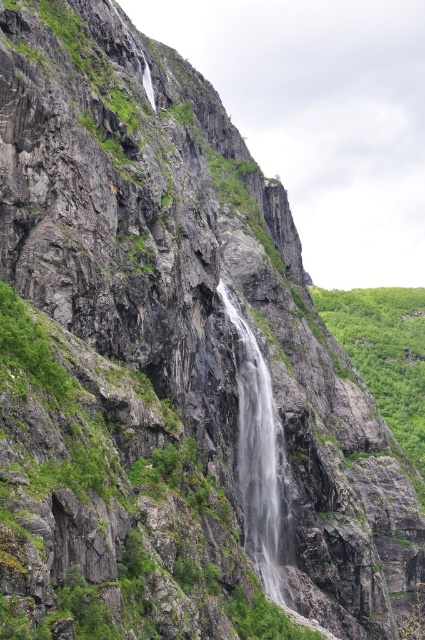
Question: Does green mossy rock at center have a larger size compared to clear gray water at center?

Choices:
 (A) no
 (B) yes

Answer: (B)

Question: Which of the following is the farthest from the observer?

Choices:
 (A) green mossy rock at center
 (B) clear gray water at center

Answer: (B)

Question: Can you confirm if green mossy rock at center is positioned to the right of clear gray water at center?

Choices:
 (A) no
 (B) yes

Answer: (A)

Question: Which point is closer to the camera?

Choices:
 (A) clear gray water at center
 (B) green mossy rock at center

Answer: (B)

Question: Can you confirm if green mossy rock at center is wider than clear gray water at center?

Choices:
 (A) no
 (B) yes

Answer: (B)